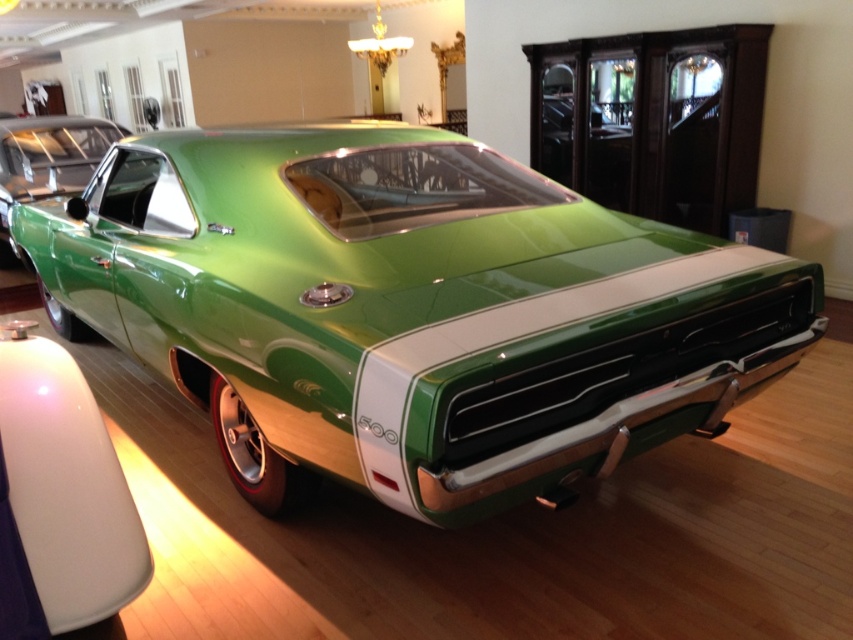
Question: Does green glossy muscle car at center appear over green glossy car at center?

Choices:
 (A) no
 (B) yes

Answer: (A)

Question: Which object is closer to the camera taking this photo?

Choices:
 (A) green glossy car at center
 (B) green glossy muscle car at center

Answer: (B)

Question: Considering the relative positions of green glossy muscle car at center and green glossy car at center in the image provided, where is green glossy muscle car at center located with respect to green glossy car at center?

Choices:
 (A) left
 (B) right

Answer: (B)

Question: Does green glossy muscle car at center appear on the right side of green glossy car at center?

Choices:
 (A) yes
 (B) no

Answer: (A)